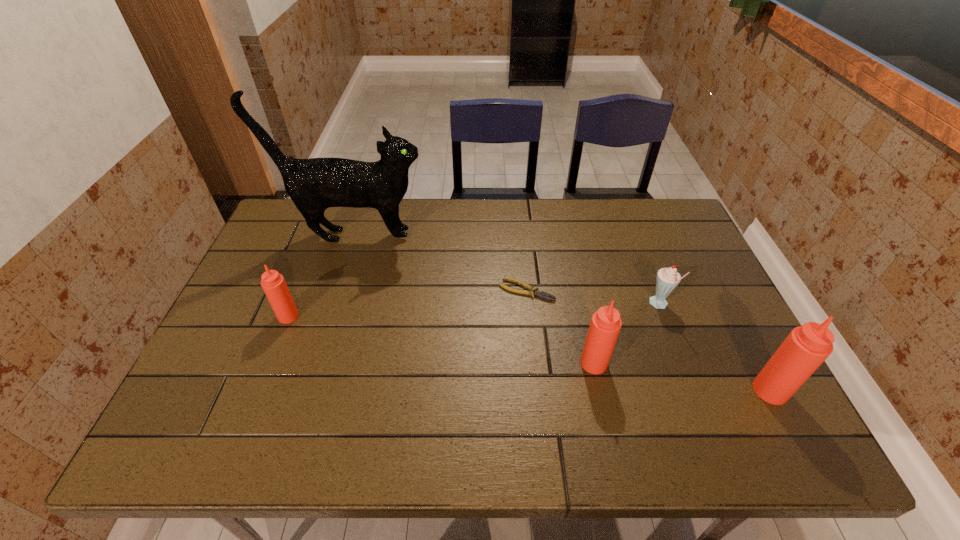
Locate an element on the screen. The height and width of the screenshot is (540, 960). vacant space that satisfies the following two spatial constraints: 1. on the back side of the fourth object from right to left; 2. on the face of the tallest object is located at coordinates (521, 236).